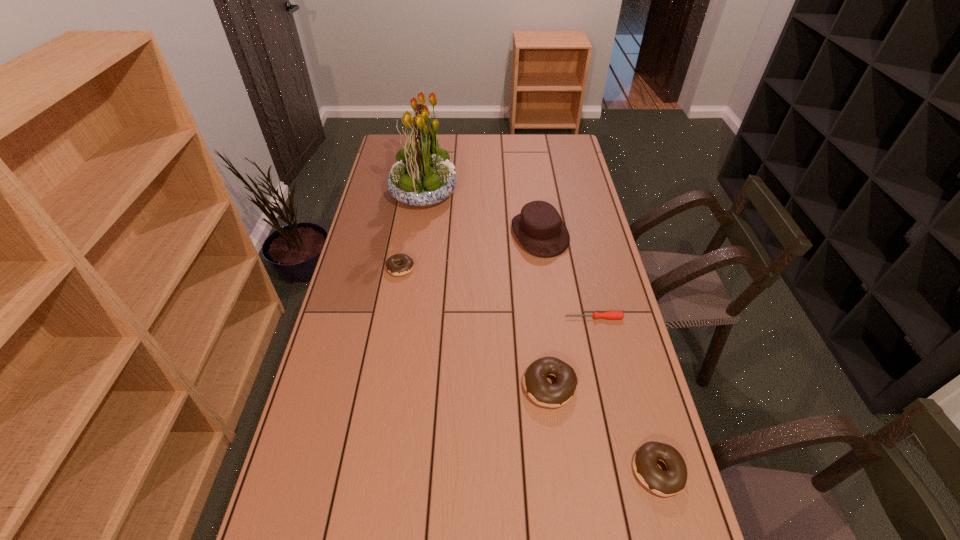
You are a GUI agent. You are given a task and a screenshot of the screen. Output one action in this format:
    pyautogui.click(x=<x>, y=<y>)
    Task: Click on the farthest doughnut
    The height and width of the screenshot is (540, 960).
    Given the screenshot: What is the action you would take?
    pyautogui.click(x=392, y=262)

I want to click on the fifth tallest object, so click(392, 262).

This screenshot has width=960, height=540. I want to click on the second nearest doughnut, so 535,382.

Where is `the tallest doughnut`? This screenshot has width=960, height=540. the tallest doughnut is located at coordinates (535, 382).

You are a GUI agent. You are given a task and a screenshot of the screen. Output one action in this format:
    pyautogui.click(x=<x>, y=<y>)
    Task: Click on the rightmost doughnut
    The image size is (960, 540).
    Given the screenshot: What is the action you would take?
    pyautogui.click(x=672, y=481)

This screenshot has height=540, width=960. In order to click on the second tallest doughnut in this screenshot , I will do `click(672, 481)`.

Identify the location of the tallest object. Image resolution: width=960 pixels, height=540 pixels. (423, 175).

Find the location of a particular element. Image resolution: width=960 pixels, height=540 pixels. the second tallest object is located at coordinates (539, 228).

In order to click on the third nearest object in this screenshot , I will do `click(611, 315)`.

Find the location of `screwdriver`. screwdriver is located at coordinates (611, 315).